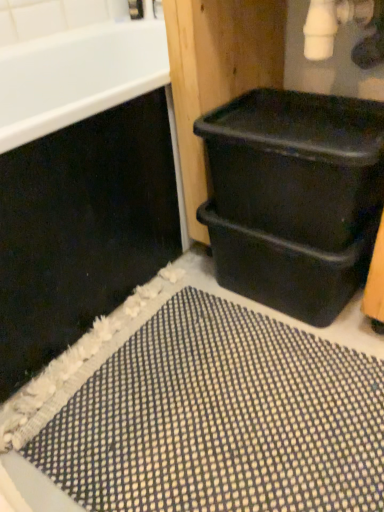
Question: Is black plastic tub at right further to camera compared to black plastic bin at lower right?

Choices:
 (A) yes
 (B) no

Answer: (B)

Question: Is black plastic tub at right wider than black plastic bin at lower right?

Choices:
 (A) no
 (B) yes

Answer: (B)

Question: Is black plastic tub at right directly adjacent to black plastic bin at lower right?

Choices:
 (A) no
 (B) yes

Answer: (A)

Question: Does black plastic tub at right have a lesser width compared to black plastic bin at lower right?

Choices:
 (A) yes
 (B) no

Answer: (B)

Question: Is black plastic tub at right bigger than black plastic bin at lower right?

Choices:
 (A) yes
 (B) no

Answer: (A)

Question: In terms of height, does black plastic tub at right look taller or shorter compared to black plastic bin at right?

Choices:
 (A) short
 (B) tall

Answer: (B)

Question: Is black plastic tub at right wider or thinner than black plastic bin at right?

Choices:
 (A) thin
 (B) wide

Answer: (B)

Question: Based on their sizes in the image, would you say black plastic tub at right is bigger or smaller than black plastic bin at right?

Choices:
 (A) small
 (B) big

Answer: (B)

Question: Is black plastic tub at right spatially inside black plastic bin at right, or outside of it?

Choices:
 (A) outside
 (B) inside

Answer: (A)

Question: Looking at their shapes, would you say black plastic bin at right is wider or thinner than black textured bath mat at lower right?

Choices:
 (A) wide
 (B) thin

Answer: (B)

Question: Is black plastic bin at right inside the boundaries of black textured bath mat at lower right, or outside?

Choices:
 (A) inside
 (B) outside

Answer: (B)

Question: From the image's perspective, is black plastic bin at right located above or below black textured bath mat at lower right?

Choices:
 (A) below
 (B) above

Answer: (B)

Question: Considering the positions of black plastic bin at right and black textured bath mat at lower right in the image, is black plastic bin at right bigger or smaller than black textured bath mat at lower right?

Choices:
 (A) big
 (B) small

Answer: (A)

Question: From the image's perspective, is black textured bath mat at lower right positioned above or below black plastic tub at right?

Choices:
 (A) above
 (B) below

Answer: (B)

Question: Is black textured bath mat at lower right taller or shorter than black plastic tub at right?

Choices:
 (A) short
 (B) tall

Answer: (A)